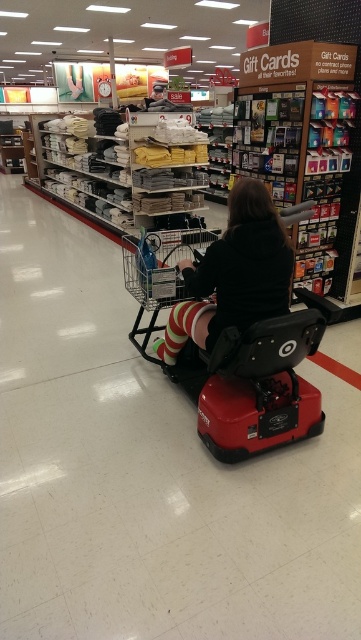
Who is positioned more to the right, red plastic mobility scooter at center or striped socks at center?

striped socks at center is more to the right.

Is red plastic mobility scooter at center to the left of striped socks at center from the viewer's perspective?

Correct, you'll find red plastic mobility scooter at center to the left of striped socks at center.

Is point (232, 397) farther from camera compared to point (258, 268)?

Yes, point (232, 397) is farther from viewer.

Image resolution: width=361 pixels, height=640 pixels. I want to click on red plastic mobility scooter at center, so click(231, 355).